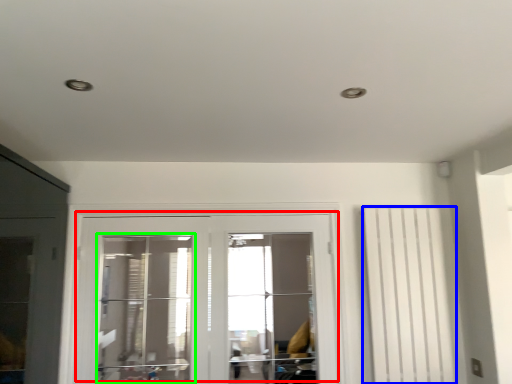
Question: Estimate the real-world distances between objects in this image. Which object is farther from door (highlighted by a red box), curtain (highlighted by a blue box) or window (highlighted by a green box)?

Choices:
 (A) curtain
 (B) window

Answer: (A)